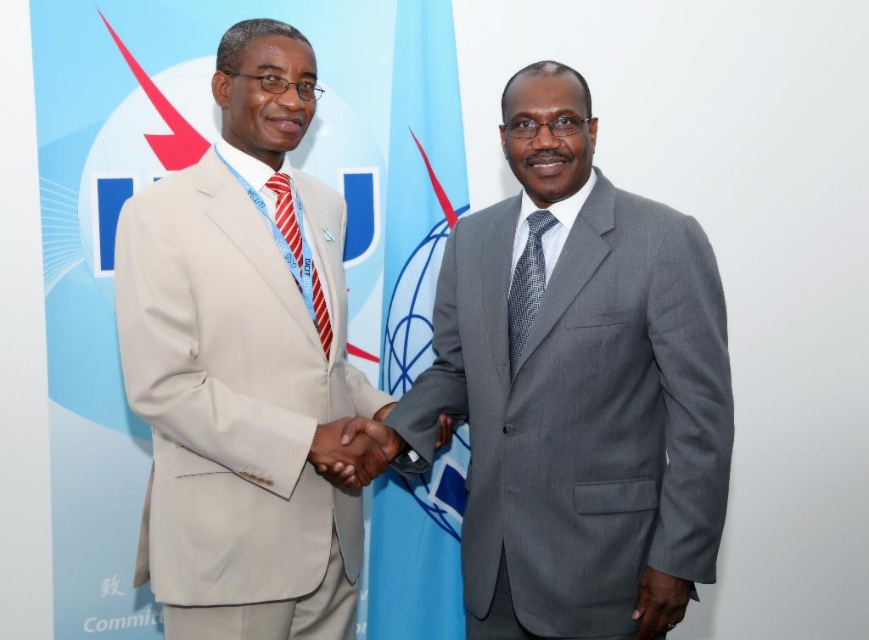
Question: Does gray suit at center appear on the right side of red striped tie at left?

Choices:
 (A) yes
 (B) no

Answer: (A)

Question: Among these objects, which one is farthest from the camera?

Choices:
 (A) gray textured tie at center
 (B) smooth skin handshake at center
 (C) dark gray fabric hand at lower right
 (D) gray suit at center

Answer: (A)

Question: Is gray suit at center above dark gray fabric hand at lower right?

Choices:
 (A) no
 (B) yes

Answer: (B)

Question: Is beige fabric suit at left positioned at the back of dark gray fabric hand at lower right?

Choices:
 (A) no
 (B) yes

Answer: (B)

Question: Which object is the closest to the gray suit at center?

Choices:
 (A) gray textured tie at center
 (B) dark gray fabric hand at lower right

Answer: (A)

Question: Among these points, which one is nearest to the camera?

Choices:
 (A) (667, 580)
 (B) (528, 236)

Answer: (A)